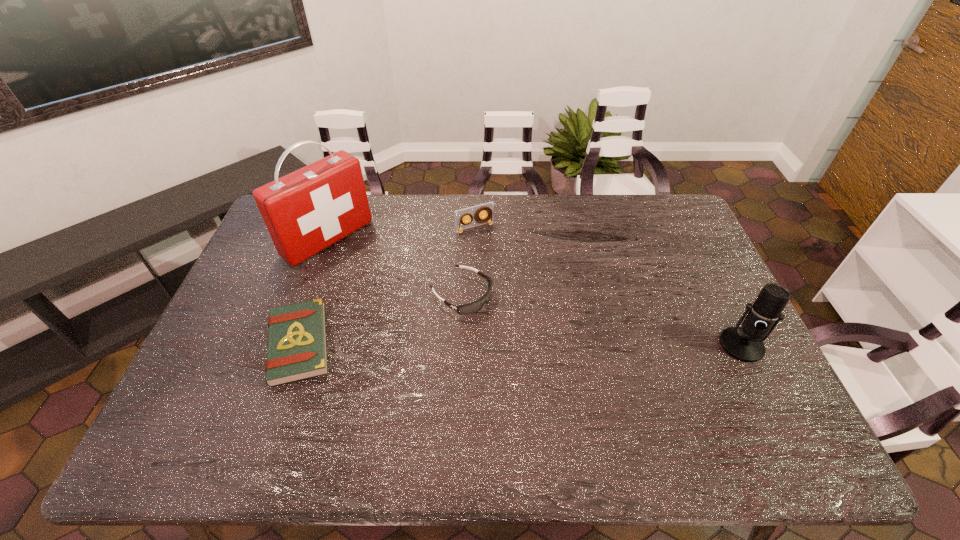
Where is `vacant space on the desktop that is between the book and the rightmost object and is positioned on the front and sides of the fourth tallest object`? This screenshot has width=960, height=540. vacant space on the desktop that is between the book and the rightmost object and is positioned on the front and sides of the fourth tallest object is located at coordinates (541, 345).

Locate an element on the screen. The width and height of the screenshot is (960, 540). vacant space on the desktop that is between the shortest object and the rightmost object and is positioned on the front face of the tallest object is located at coordinates (465, 345).

You are a GUI agent. You are given a task and a screenshot of the screen. Output one action in this format:
    pyautogui.click(x=<x>, y=<y>)
    Task: Click on the vacant space on the desktop that is between the shortest object and the second tallest object and is positioned at the front of the third shortest object with visible reels
    
    Given the screenshot: What is the action you would take?
    pyautogui.click(x=549, y=345)